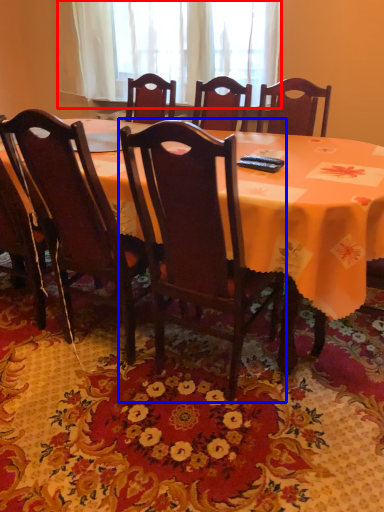
Question: Which object is closer to the camera taking this photo, curtain (highlighted by a red box) or chair (highlighted by a blue box)?

Choices:
 (A) curtain
 (B) chair

Answer: (B)